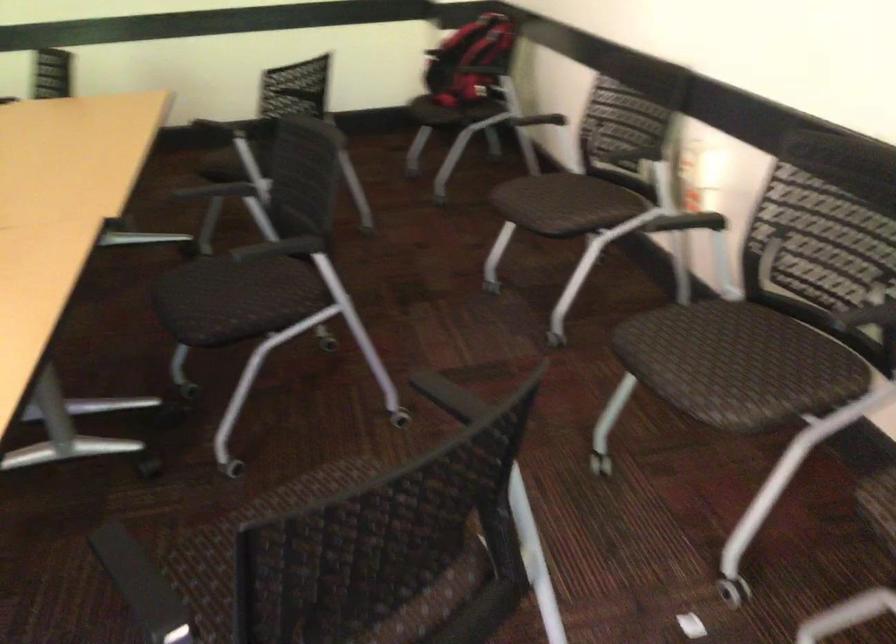
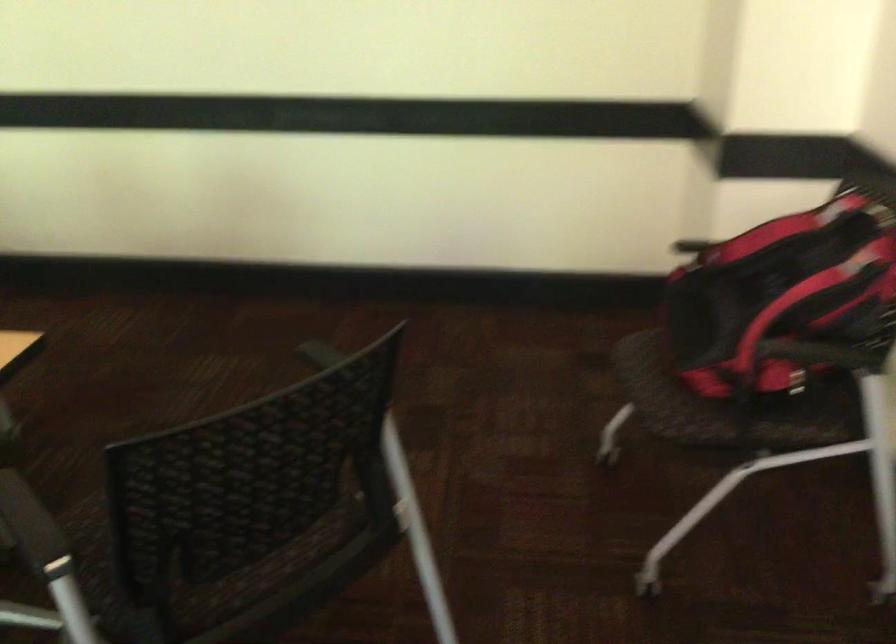
Question: Which direction would the cameraman need to move to produce the second image? Reply with the corresponding letter.

Choices:
 (A) Left
 (B) Right
 (C) Forward
 (D) Backward

Answer: (C)